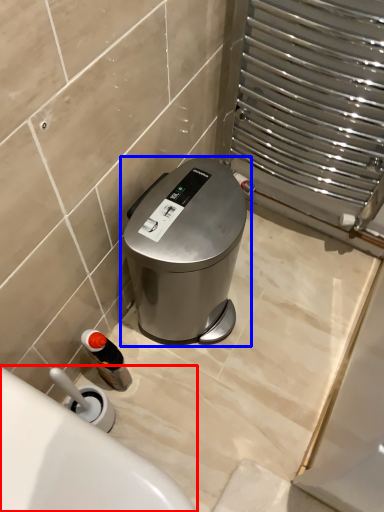
Question: Which object appears farthest to the camera in this image, bath (highlighted by a red box) or waste container (highlighted by a blue box)?

Choices:
 (A) bath
 (B) waste container

Answer: (B)